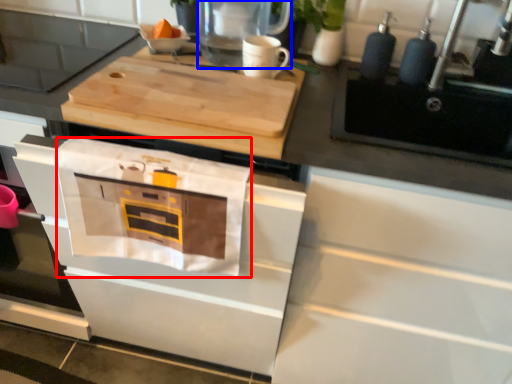
Question: Which point is further to the camera, cloth (highlighted by a red box) or kitchen appliance (highlighted by a blue box)?

Choices:
 (A) cloth
 (B) kitchen appliance

Answer: (B)